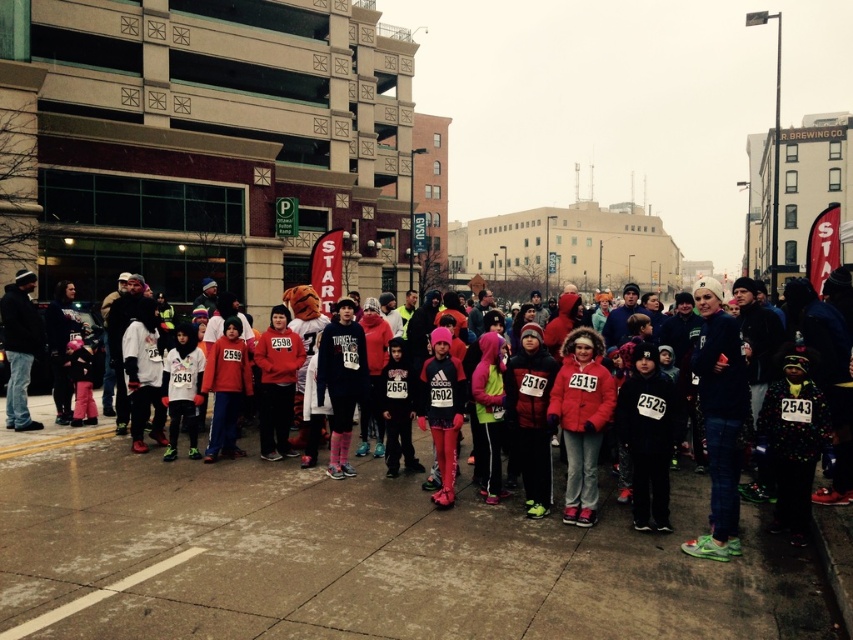
Is matte red jacket at center smaller than pink matte leggings at center?

Indeed, matte red jacket at center has a smaller size compared to pink matte leggings at center.

Can you confirm if matte red jacket at center is positioned below pink matte leggings at center?

Correct, matte red jacket at center is located below pink matte leggings at center.

You are a GUI agent. You are given a task and a screenshot of the screen. Output one action in this format:
    pyautogui.click(x=<x>, y=<y>)
    Task: Click on the matte red jacket at center
    This screenshot has height=640, width=853.
    Given the screenshot: What is the action you would take?
    pyautogui.click(x=317, y=528)

Where is `matte red jacket at center`? The image size is (853, 640). matte red jacket at center is located at coordinates (317, 528).

Can you confirm if matte red coat at center is positioned below pink matte leggings at center?

No.

The width and height of the screenshot is (853, 640). Describe the element at coordinates (581, 419) in the screenshot. I see `matte red coat at center` at that location.

The width and height of the screenshot is (853, 640). In order to click on matte red coat at center in this screenshot , I will do `click(581, 419)`.

Who is higher up, matte red coat at center or matte black hoodie at center?

matte black hoodie at center

The height and width of the screenshot is (640, 853). What do you see at coordinates (581, 419) in the screenshot?
I see `matte red coat at center` at bounding box center [581, 419].

The width and height of the screenshot is (853, 640). What are the coordinates of `matte red coat at center` in the screenshot? It's located at (581, 419).